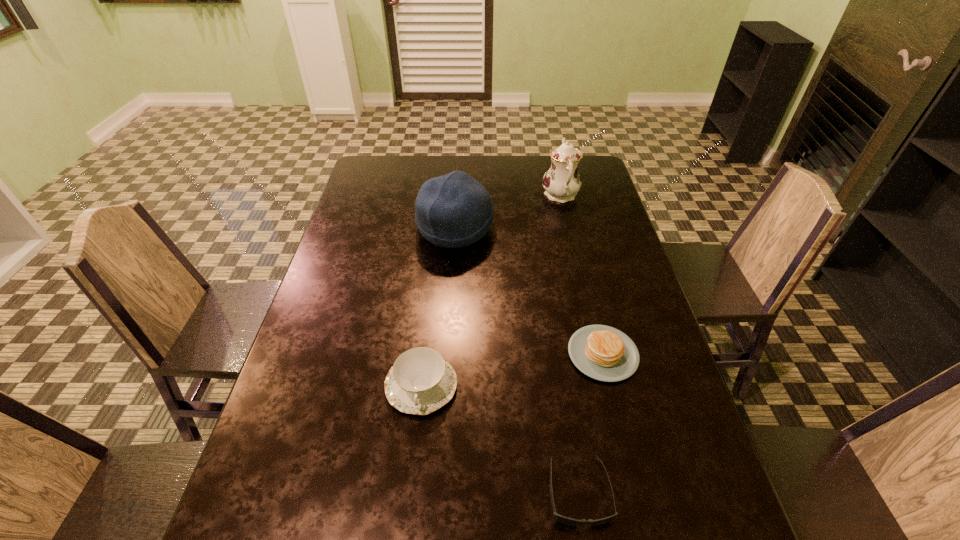
The height and width of the screenshot is (540, 960). Find the location of `the right chinaware`. the right chinaware is located at coordinates (562, 182).

Find the location of a particular element. The image size is (960, 540). the farther chinaware is located at coordinates (562, 182).

Where is `skullcap`? Image resolution: width=960 pixels, height=540 pixels. skullcap is located at coordinates (454, 210).

I want to click on the nearer chinaware, so click(421, 381).

Identify the location of the left chinaware. (421, 381).

The image size is (960, 540). Find the location of `pancake`. pancake is located at coordinates (604, 353).

The height and width of the screenshot is (540, 960). I want to click on sunglasses, so click(x=562, y=519).

The width and height of the screenshot is (960, 540). I want to click on the shortest object, so click(x=562, y=519).

This screenshot has height=540, width=960. I want to click on free spot located on the back of the right chinaware, so click(x=551, y=156).

Locate an element on the screen. free space located on the front of the skullcap is located at coordinates (448, 339).